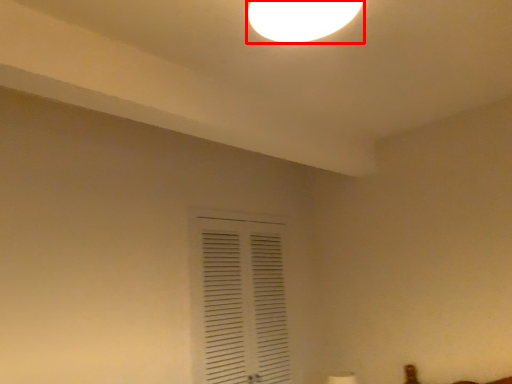
Question: From the image's perspective, where is lamp (annotated by the red box) located in relation to window in the image?

Choices:
 (A) below
 (B) above

Answer: (B)